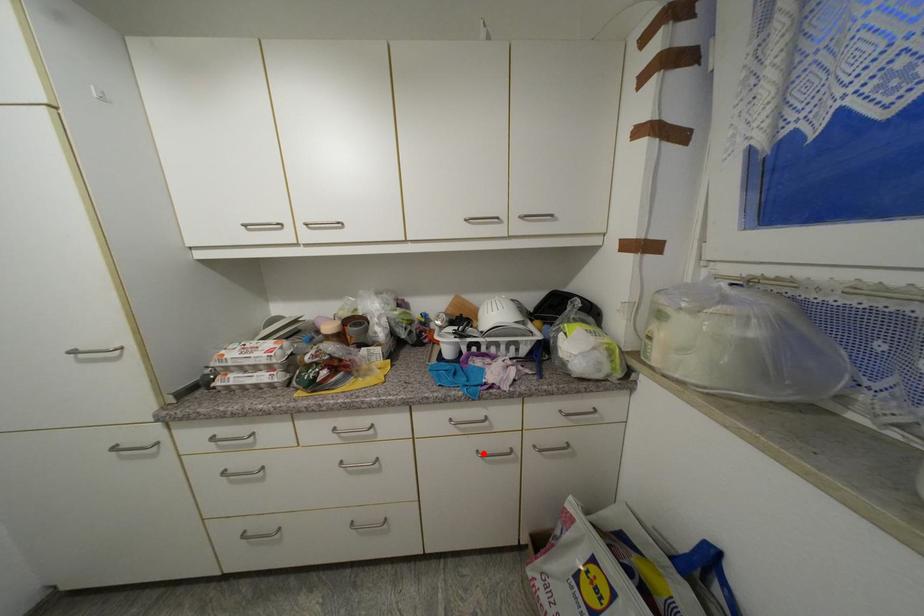
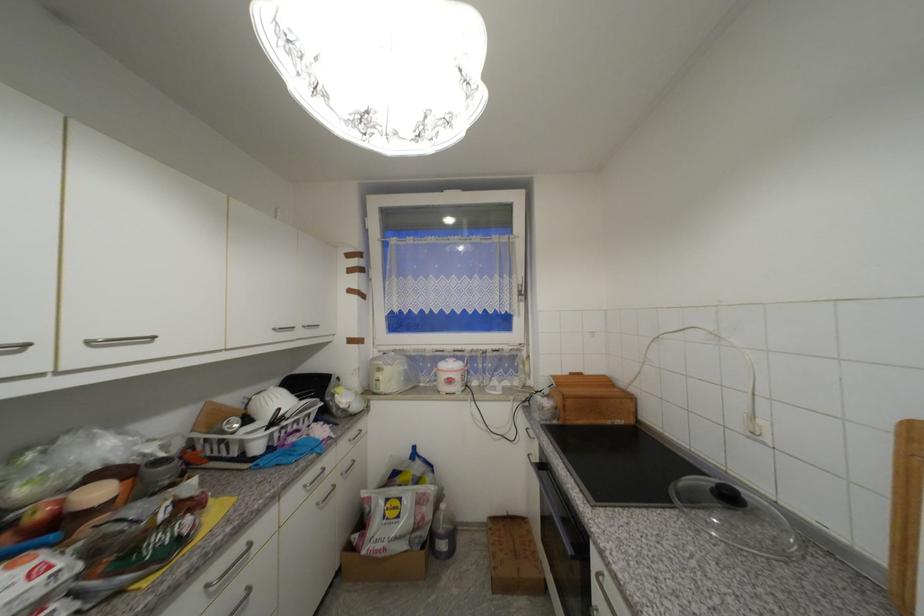
Question: I am providing you with two images of the same scene from different viewpoints. Given a red point in image1, look at the same physical point in image2. Is it:

Choices:
 (A) Closer to the viewpoint
 (B) Farther from the viewpoint

Answer: (A)